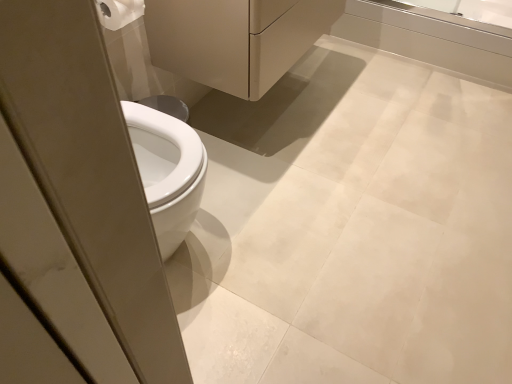
What is the approximate width of white matte toilet paper at upper left?

The width of white matte toilet paper at upper left is 5.05 inches.

Measure the distance between white glossy bathtub at upper right and camera.

white glossy bathtub at upper right is 6.36 feet away from camera.

Find the location of a particular element. This screenshot has width=512, height=384. white glossy bathtub at upper right is located at coordinates (430, 38).

You are a GUI agent. You are given a task and a screenshot of the screen. Output one action in this format:
    pyautogui.click(x=<x>, y=<y>)
    Task: Click on the matte white porcelain at center
    Image resolution: width=512 pixels, height=384 pixels.
    Given the screenshot: What is the action you would take?
    pyautogui.click(x=234, y=39)

Does white matte toilet paper at upper left appear on the left side of transparent glass screen door at left?

Yes, white matte toilet paper at upper left is to the left of transparent glass screen door at left.

Which of these two, white matte toilet paper at upper left or transparent glass screen door at left, is wider?

With larger width is transparent glass screen door at left.

Is white matte toilet paper at upper left next to transparent glass screen door at left and touching it?

They are not placed beside each other.

Is matte white porcelain at center at the back of transparent glass screen door at left?

transparent glass screen door at left is not turned away from matte white porcelain at center.

Who is shorter, transparent glass screen door at left or matte white porcelain at center?

Standing shorter between the two is matte white porcelain at center.

Is transparent glass screen door at left completely or partially outside of matte white porcelain at center?

Yes.

You are a GUI agent. You are given a task and a screenshot of the screen. Output one action in this format:
    pyautogui.click(x=<x>, y=<y>)
    Task: Click on the porcelain lying above the transparent glass screen door at left (from the image's perspective)
    
    Given the screenshot: What is the action you would take?
    pyautogui.click(x=234, y=39)

In the image, is white glossy bathtub at upper right positioned in front of or behind white matte toilet paper at upper left?

white glossy bathtub at upper right is positioned farther from the viewer than white matte toilet paper at upper left.

What's the angular difference between white glossy bathtub at upper right and white matte toilet paper at upper left's facing directions?

There is a 90.9-degree angle between the facing directions of white glossy bathtub at upper right and white matte toilet paper at upper left.

From their relative heights in the image, would you say white glossy bathtub at upper right is taller or shorter than white matte toilet paper at upper left?

Clearly, white glossy bathtub at upper right is taller compared to white matte toilet paper at upper left.

Would you say white glossy bathtub at upper right is to the left or to the right of white matte toilet paper at upper left in the picture?

In the image, white glossy bathtub at upper right appears on the right side of white matte toilet paper at upper left.

From the picture: What's the angular difference between white matte toilet paper at upper left and white glossy bathtub at upper right's facing directions?

There is a 90.9-degree angle between the facing directions of white matte toilet paper at upper left and white glossy bathtub at upper right.

Considering the sizes of white matte toilet paper at upper left and white glossy bathtub at upper right in the image, is white matte toilet paper at upper left taller or shorter than white glossy bathtub at upper right?

Clearly, white matte toilet paper at upper left is shorter compared to white glossy bathtub at upper right.

From the image's perspective, does white matte toilet paper at upper left appear higher than white glossy bathtub at upper right?

Incorrect, from the image's perspective, white matte toilet paper at upper left is lower than white glossy bathtub at upper right.

Is white matte toilet paper at upper left turned away from white glossy bathtub at upper right?

No, white matte toilet paper at upper left is not facing the opposite direction of white glossy bathtub at upper right.

Who is taller, transparent glass screen door at left or white glossy bathtub at upper right?

transparent glass screen door at left is taller.

Identify the location of screen door on the left side of white glossy bathtub at upper right. click(89, 172).

From a real-world perspective, between transparent glass screen door at left and white glossy bathtub at upper right, who is vertically higher?

transparent glass screen door at left is physically above.

Which is nearer, (32, 69) or (471, 56)?

Clearly, point (32, 69) is closer to the camera than point (471, 56).

From the image's perspective, would you say white glossy bathtub at upper right is shown under matte white porcelain at center?

Incorrect, from the image's perspective, white glossy bathtub at upper right is higher than matte white porcelain at center.

From a real-world perspective, is white glossy bathtub at upper right located higher than matte white porcelain at center?

Incorrect, from a real-world perspective, white glossy bathtub at upper right is lower than matte white porcelain at center.

How distant is white glossy bathtub at upper right from matte white porcelain at center?

34.23 inches.

In the image, is white glossy bathtub at upper right on the left side or the right side of matte white porcelain at center?

From the image, it's evident that white glossy bathtub at upper right is to the right of matte white porcelain at center.

Is transparent glass screen door at left positioned before white matte toilet paper at upper left?

That is True.

From a real-world perspective, does transparent glass screen door at left sit lower than white matte toilet paper at upper left?

Yes, from a real-world perspective, transparent glass screen door at left is below white matte toilet paper at upper left.

Is white matte toilet paper at upper left located within transparent glass screen door at left?

Definitely not — white matte toilet paper at upper left is not inside transparent glass screen door at left.

Is transparent glass screen door at left aimed at white matte toilet paper at upper left?

No, transparent glass screen door at left is not turned towards white matte toilet paper at upper left.

Where is `toilet paper above the transparent glass screen door at left (from the image's perspective)`? toilet paper above the transparent glass screen door at left (from the image's perspective) is located at coordinates click(119, 12).

Find the location of a particular element. porcelain on the right of transparent glass screen door at left is located at coordinates (234, 39).

Which object lies nearer to the anchor point transparent glass screen door at left, matte white porcelain at center or white glossy bathtub at upper right?

matte white porcelain at center lies closer to transparent glass screen door at left than the other object.

When comparing their distances from white glossy bathtub at upper right, does transparent glass screen door at left or white matte toilet paper at upper left seem closer?

Based on the image, white matte toilet paper at upper left appears to be nearer to white glossy bathtub at upper right.

When comparing their distances from white matte toilet paper at upper left, does matte white porcelain at center or white glossy bathtub at upper right seem closer?

The object closer to white matte toilet paper at upper left is matte white porcelain at center.

Based on the photo, based on their spatial positions, is matte white porcelain at center or transparent glass screen door at left further from white matte toilet paper at upper left?

The object further to white matte toilet paper at upper left is transparent glass screen door at left.

In the scene shown: Estimate the real-world distances between objects in this image. Which object is closer to white matte toilet paper at upper left, transparent glass screen door at left or matte white porcelain at center?

Among the two, matte white porcelain at center is located nearer to white matte toilet paper at upper left.

Based on their spatial positions, is transparent glass screen door at left or white glossy bathtub at upper right closer to matte white porcelain at center?

white glossy bathtub at upper right.

Considering their positions, is white matte toilet paper at upper left positioned further to matte white porcelain at center than white glossy bathtub at upper right?

white glossy bathtub at upper right lies further to matte white porcelain at center than the other object.

Looking at the image, which one is located further to matte white porcelain at center, white glossy bathtub at upper right or white matte toilet paper at upper left?

white glossy bathtub at upper right lies further to matte white porcelain at center than the other object.

Where is `porcelain between white matte toilet paper at upper left and white glossy bathtub at upper right from left to right`? The width and height of the screenshot is (512, 384). porcelain between white matte toilet paper at upper left and white glossy bathtub at upper right from left to right is located at coordinates (234, 39).

The image size is (512, 384). Identify the location of screen door situated between white matte toilet paper at upper left and white glossy bathtub at upper right from left to right. (89, 172).

Find the location of a particular element. This screenshot has width=512, height=384. porcelain between transparent glass screen door at left and white glossy bathtub at upper right along the z-axis is located at coordinates (234, 39).

At what (x,y) coordinates should I click in order to perform the action: click on toilet paper between matte white porcelain at center and transparent glass screen door at left from top to bottom. Please return your answer as a coordinate pair (x, y). This screenshot has width=512, height=384. Looking at the image, I should click on (119, 12).